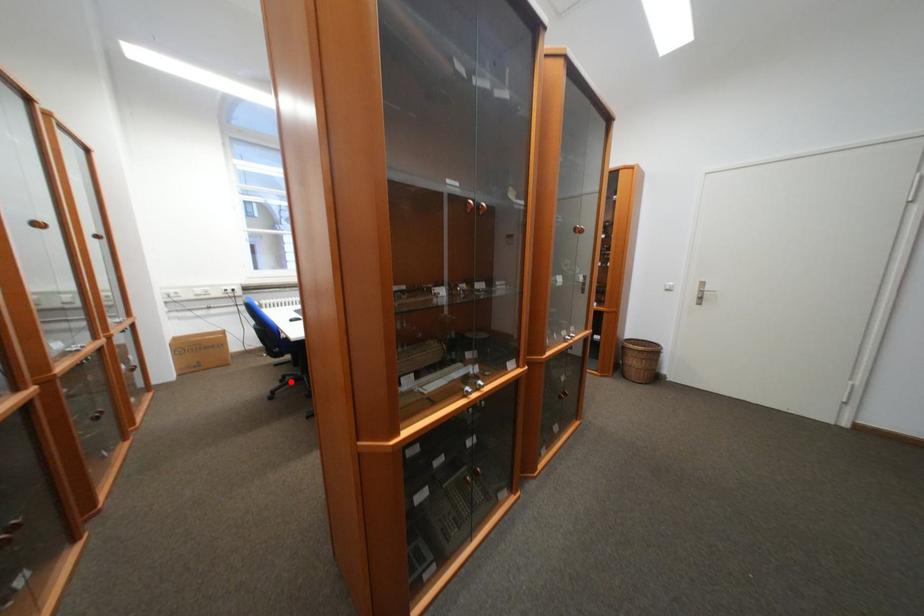
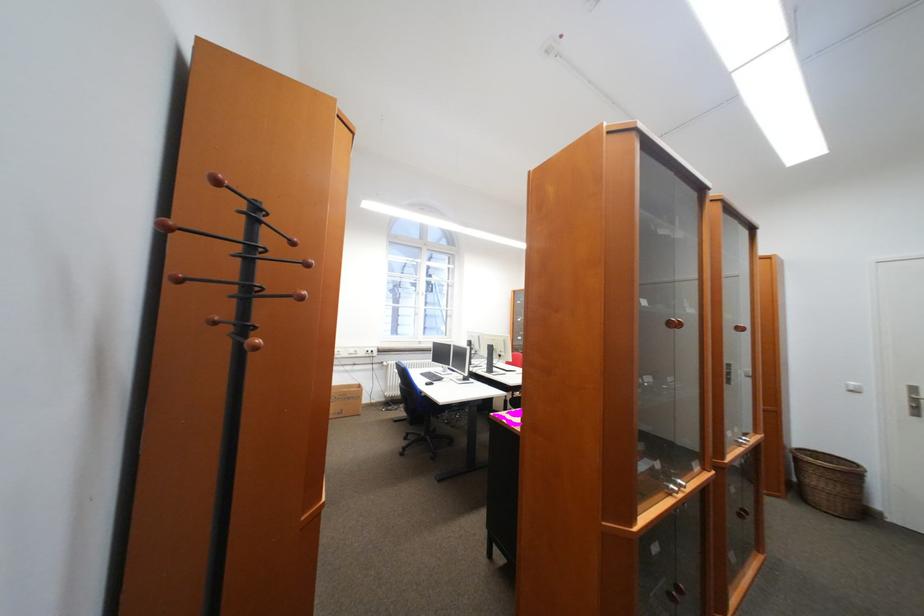
Question: I am providing you with two images of the same scene from different viewpoints. Given a red point in image1, look at the same physical point in image2. Is it:

Choices:
 (A) Closer to the viewpoint
 (B) Farther from the viewpoint

Answer: (B)